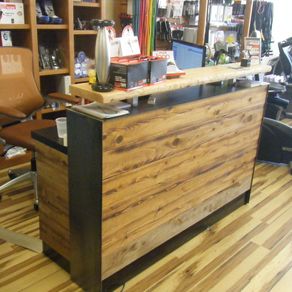
Find the location of a particular element. This screenshot has width=292, height=292. floor is located at coordinates (233, 260).